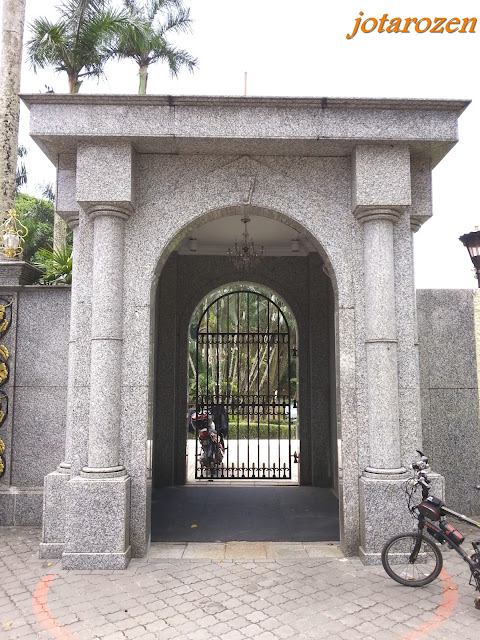
This screenshot has height=640, width=480. I want to click on lamp, so click(10, 237).